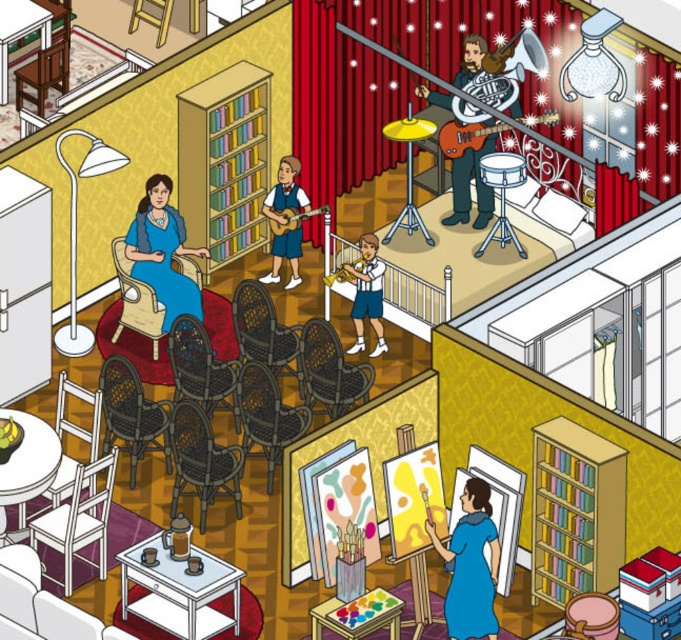
Question: Which point appears farthest from the camera in this image?

Choices:
 (A) click(x=285, y=230)
 (B) click(x=153, y=232)
 (C) click(x=477, y=54)
 (D) click(x=358, y=317)

Answer: (A)

Question: Which object is positioned farthest from the matte blue dress at left?

Choices:
 (A) wooden electric guitar at upper center
 (B) white uniform at center
 (C) blue fabric dress at lower center
 (D) shiny red guitar at upper center

Answer: (C)

Question: Which point is farther to the camera?

Choices:
 (A) (279, 234)
 (B) (494, 556)

Answer: (A)

Question: Can you confirm if blue fabric dress at lower center is smaller than shiny red guitar at upper center?

Choices:
 (A) yes
 (B) no

Answer: (B)

Question: Can you confirm if matte blue dress at left is thinner than wooden electric guitar at upper center?

Choices:
 (A) yes
 (B) no

Answer: (A)

Question: Is wooden electric guitar at upper center smaller than wooden acoustic guitar at center?

Choices:
 (A) yes
 (B) no

Answer: (B)